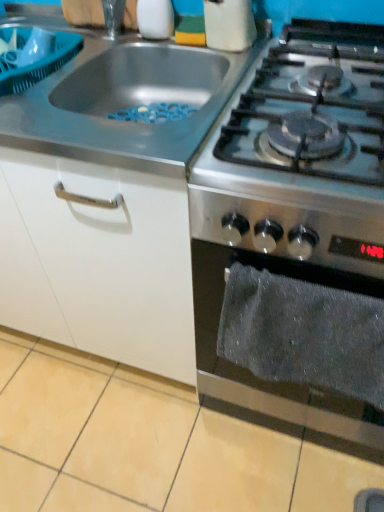
Question: Does stainless steel gas stove at right, which is counted as the second gas stove, starting from the left, have a larger size compared to gray fabric towel at lower right?

Choices:
 (A) no
 (B) yes

Answer: (B)

Question: From a real-world perspective, is stainless steel gas stove at right, positioned as the first gas stove in right-to-left order, physically above gray fabric towel at lower right?

Choices:
 (A) no
 (B) yes

Answer: (A)

Question: Can you confirm if stainless steel gas stove at right, which is counted as the second gas stove, starting from the left, is smaller than gray fabric towel at lower right?

Choices:
 (A) no
 (B) yes

Answer: (A)

Question: Is stainless steel gas stove at right, positioned as the first gas stove in right-to-left order, taller than gray fabric towel at lower right?

Choices:
 (A) no
 (B) yes

Answer: (B)

Question: Could you tell me if stainless steel gas stove at right, which is counted as the second gas stove, starting from the left, is turned towards gray fabric towel at lower right?

Choices:
 (A) no
 (B) yes

Answer: (B)

Question: Considering the relative positions of stainless steel gas stove at right, which is counted as the second gas stove, starting from the left, and gray fabric towel at lower right in the image provided, is stainless steel gas stove at right, which is counted as the second gas stove, starting from the left, to the right of gray fabric towel at lower right from the viewer's perspective?

Choices:
 (A) no
 (B) yes

Answer: (B)

Question: From a real-world perspective, does stainless steel gas stove at upper right, which appears as the 2th gas stove when viewed from the right, sit lower than white glossy salt shaker at upper center?

Choices:
 (A) yes
 (B) no

Answer: (A)

Question: Does stainless steel gas stove at upper right, which appears as the 2th gas stove when viewed from the right, come behind white glossy salt shaker at upper center?

Choices:
 (A) no
 (B) yes

Answer: (A)

Question: Is the position of stainless steel gas stove at upper right, which appears as the 2th gas stove when viewed from the right, less distant than that of white glossy salt shaker at upper center?

Choices:
 (A) yes
 (B) no

Answer: (A)

Question: Does stainless steel gas stove at upper right, which appears as the 2th gas stove when viewed from the right, have a lesser width compared to white glossy salt shaker at upper center?

Choices:
 (A) yes
 (B) no

Answer: (B)

Question: Does stainless steel gas stove at upper right, the 1th gas stove positioned from the left, have a lesser height compared to white glossy salt shaker at upper center?

Choices:
 (A) no
 (B) yes

Answer: (B)

Question: Could white glossy salt shaker at upper center be considered to be inside stainless steel gas stove at upper right, the 1th gas stove positioned from the left?

Choices:
 (A) yes
 (B) no

Answer: (B)

Question: Is white glossy salt shaker at upper center oriented towards stainless steel gas stove at right, positioned as the first gas stove in right-to-left order?

Choices:
 (A) yes
 (B) no

Answer: (B)